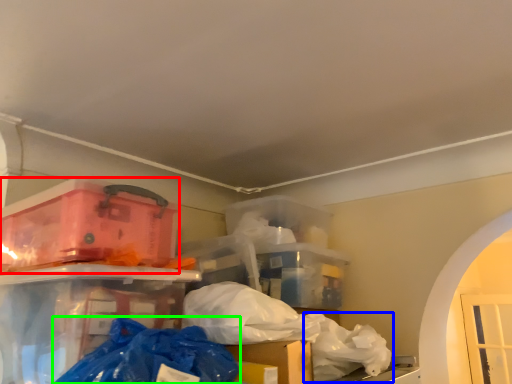
Question: Which object is the closest to the box (highlighted by a red box)? Choose among these: plastic bag (highlighted by a blue box) or plastic bag (highlighted by a green box).

Choices:
 (A) plastic bag
 (B) plastic bag

Answer: (B)